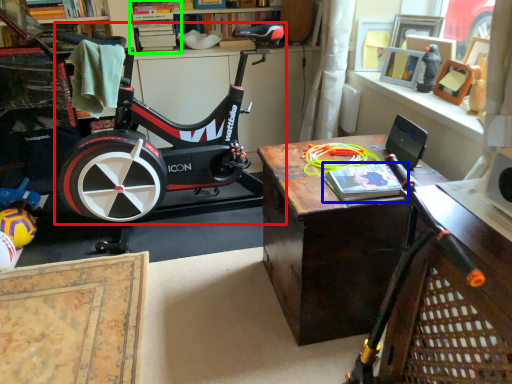
Question: Considering the real-world distances, which object is farthest from stationary bicycle (highlighted by a red box)? book (highlighted by a blue box) or shelf (highlighted by a green box)?

Choices:
 (A) book
 (B) shelf

Answer: (A)